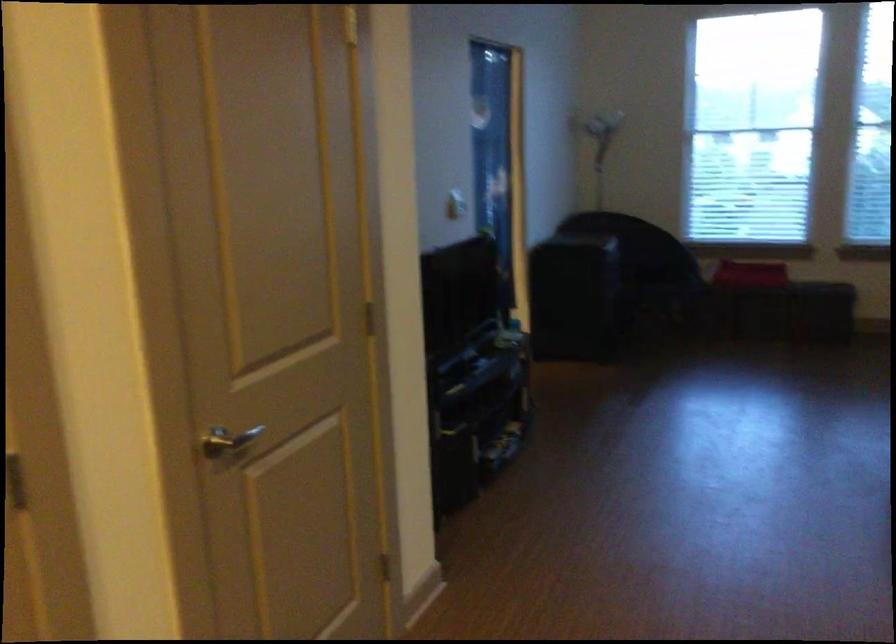
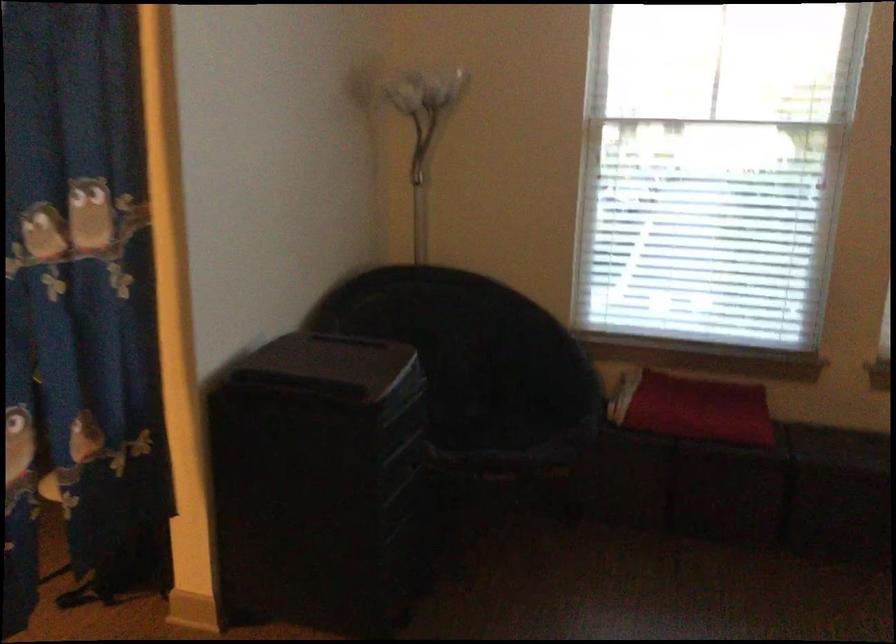
Question: Which direction would the cameraman need to move to produce the second image? Reply with the corresponding letter.

Choices:
 (A) Left
 (B) Right
 (C) Forward
 (D) Backward

Answer: (C)